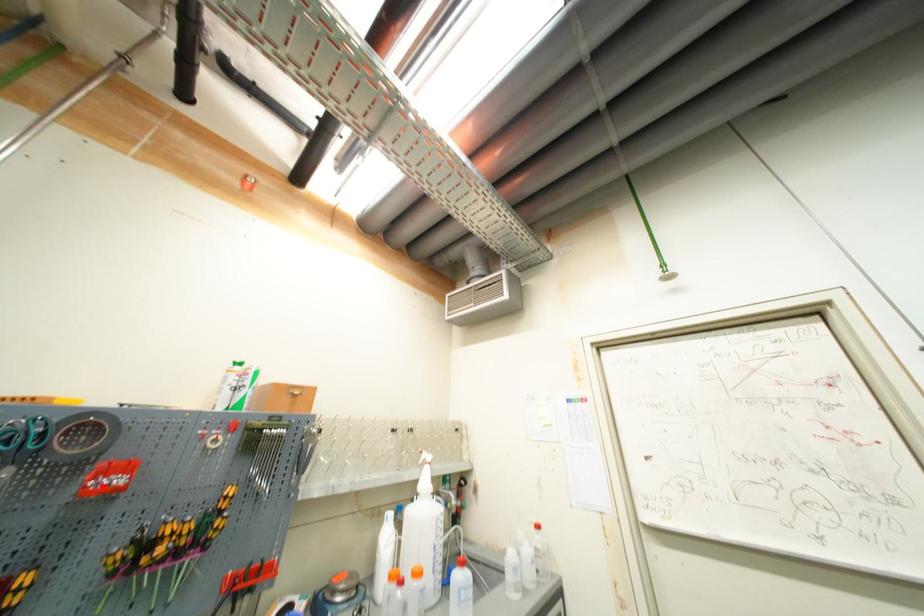
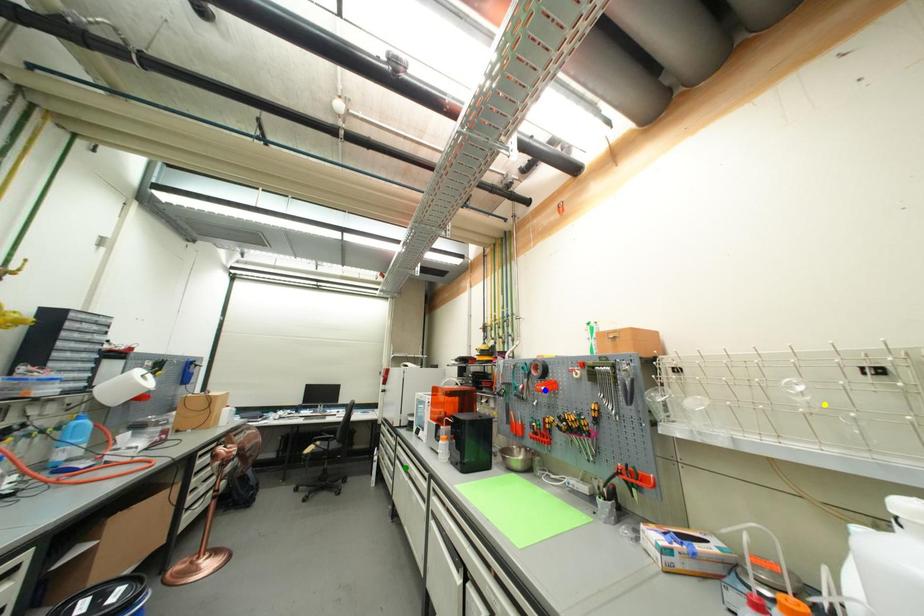
Question: I am providing you with two images of the same scene from different viewpoints. A red point is marked on the first image. You are given multiple points on the second image. Which point in image 2 represents the same 3d spot as the red point in image 1?

Choices:
 (A) green point
 (B) yellow point
 (C) blue point

Answer: (C)